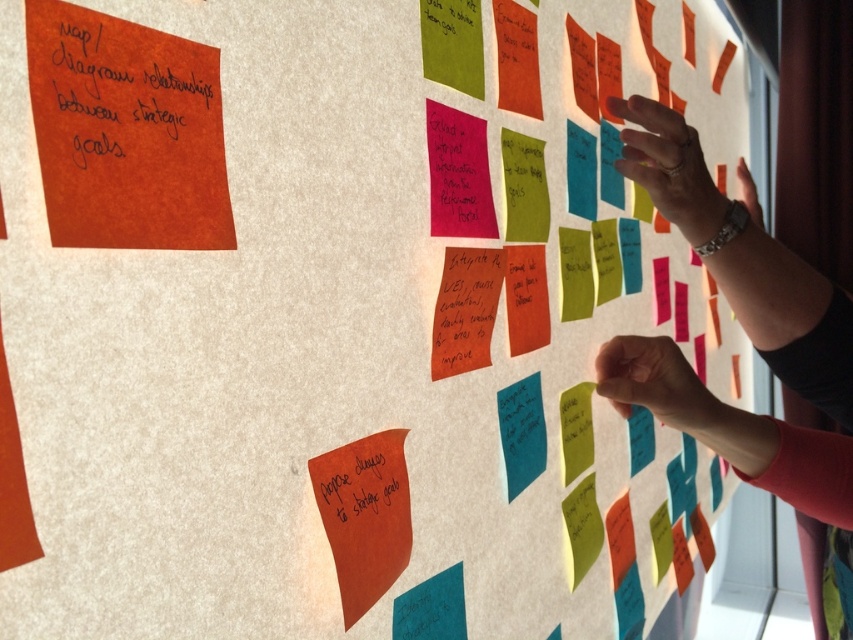
Question: Does orange matte paper at upper left have a larger size compared to matte orange sticky note at bottom left?

Choices:
 (A) yes
 (B) no

Answer: (B)

Question: Among these points, which one is farthest from the camera?

Choices:
 (A) coord(221,170)
 (B) coord(310,464)
 (C) coord(171,96)
 (D) coord(822,400)

Answer: (D)

Question: Which object is closer to the camera taking this photo?

Choices:
 (A) orange matte paper at upper left
 (B) metallic wristwatch at upper right
 (C) matte orange sticky note at bottom left

Answer: (A)

Question: Does metallic wristwatch at upper right appear on the right side of orange matte sticky note at upper left?

Choices:
 (A) yes
 (B) no

Answer: (A)

Question: Does metallic wristwatch at upper right have a larger size compared to matte orange sticky note at bottom left?

Choices:
 (A) no
 (B) yes

Answer: (B)

Question: Which point appears farthest from the camera in this image?

Choices:
 (A) (201, 129)
 (B) (364, 456)
 (C) (790, 428)
 (D) (51, 70)

Answer: (C)